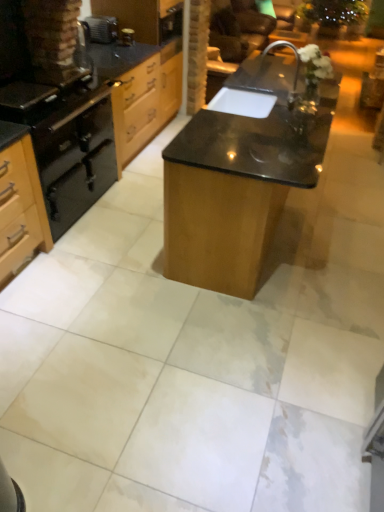
Locate an element on the screen. Image resolution: width=384 pixels, height=512 pixels. free spot behind metallic canister at upper center, the first appliance from the right is located at coordinates (128, 45).